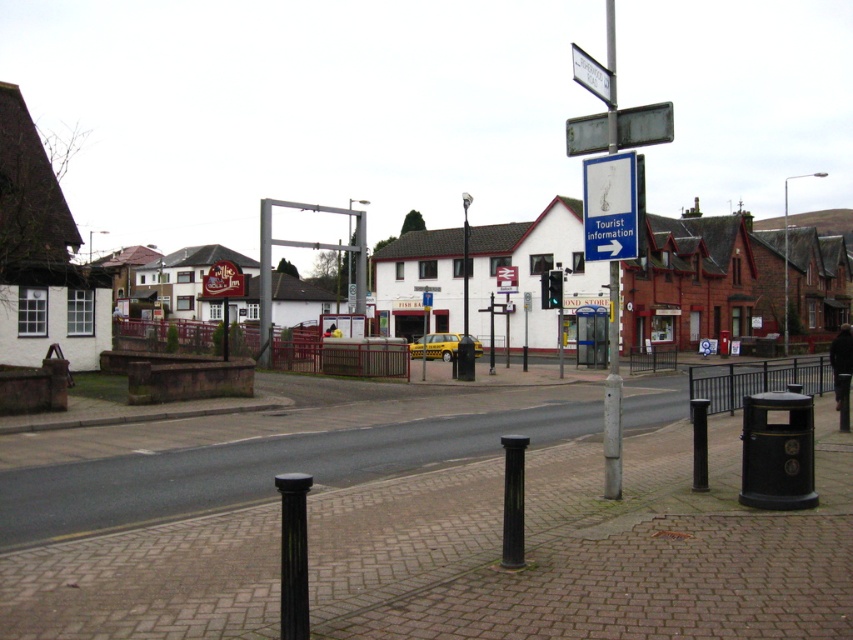
Question: Where is metallic street sign at upper center located in relation to white plastic street sign at upper center in the image?

Choices:
 (A) left
 (B) right

Answer: (A)

Question: Among these points, which one is farthest from the camera?

Choices:
 (A) (595, 67)
 (B) (701, 321)
 (C) (610, 104)
 (D) (633, 113)

Answer: (B)

Question: Observing the image, what is the correct spatial positioning of blue plastic sign at upper center in reference to silver metallic pole at center?

Choices:
 (A) above
 (B) below

Answer: (B)

Question: Is white painted building at center closer to camera compared to white plastic street sign at upper center?

Choices:
 (A) no
 (B) yes

Answer: (B)

Question: Among these objects, which one is nearest to the camera?

Choices:
 (A) blue plastic sign at upper center
 (B) white painted building at center
 (C) white plastic street sign at upper center
 (D) silver metallic pole at center

Answer: (B)

Question: Which object appears closest to the camera in this image?

Choices:
 (A) silver metallic pole at center
 (B) white painted building at center
 (C) blue plastic sign at upper center

Answer: (B)